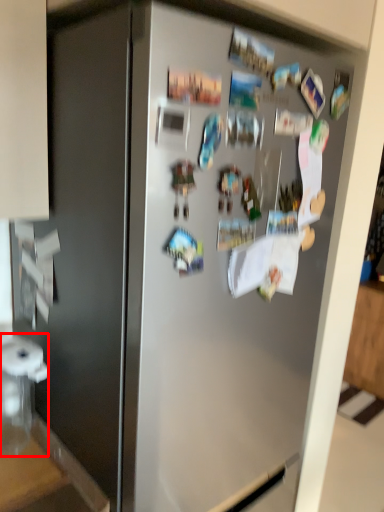
Question: Observing the image, what is the correct spatial positioning of appliance (annotated by the red box) in reference to counter top?

Choices:
 (A) right
 (B) left

Answer: (A)